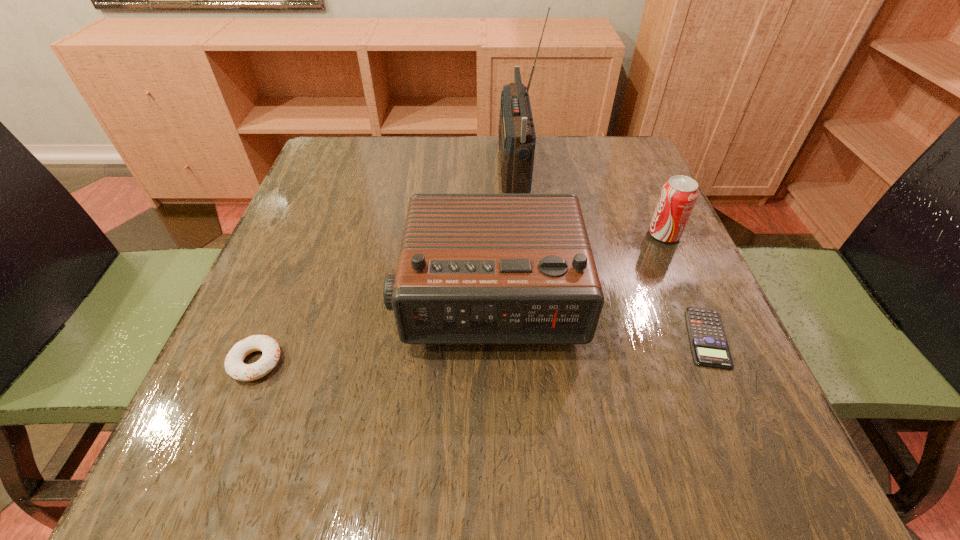
At what (x,y) coordinates should I click in order to perform the action: click on vacant region located 0.120m on the front-facing side of the farther radio receiver. Please return your answer as a coordinate pair (x, y). The image size is (960, 540). Looking at the image, I should click on (450, 167).

Locate an element on the screen. This screenshot has width=960, height=540. vacant space positioned 0.280m on the front-facing side of the farther radio receiver is located at coordinates (386, 167).

Image resolution: width=960 pixels, height=540 pixels. In order to click on vacant region located on the front panel of the fourth shortest object in this screenshot , I will do `click(491, 472)`.

I want to click on free point located on the logo side of the third shortest object, so click(x=599, y=235).

Identify the location of vacant space located 0.140m on the logo side of the third shortest object. This screenshot has width=960, height=540. (580, 235).

This screenshot has width=960, height=540. Identify the location of blank space located 0.300m on the logo side of the third shortest object. (502, 235).

Identify the location of free space located on the right of the doughnut. (512, 362).

I want to click on vacant region located on the back of the shortest object, so click(652, 213).

Locate an element on the screen. The height and width of the screenshot is (540, 960). object present at the far edge is located at coordinates (517, 137).

Locate an element on the screen. object positioned at the left edge is located at coordinates (234, 366).